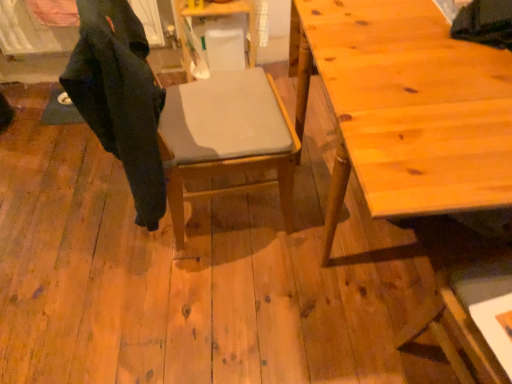
The width and height of the screenshot is (512, 384). What do you see at coordinates (406, 107) in the screenshot?
I see `wooden table at right, which is the first table in bottom-to-top order` at bounding box center [406, 107].

What is the approximate width of matte gray cushion at center?

It is 19.67 inches.

Image resolution: width=512 pixels, height=384 pixels. I want to click on wooden table at center, which ranks as the 2th table in right-to-left order, so click(x=220, y=15).

Describe the element at coordinates (220, 15) in the screenshot. Image resolution: width=512 pixels, height=384 pixels. I see `wooden table at center, placed as the 1th table when sorted from top to bottom` at that location.

This screenshot has width=512, height=384. What are the coordinates of `dark matte fabric robe at left` in the screenshot? It's located at (120, 98).

The image size is (512, 384). I want to click on wooden table at right, acting as the 2th table starting from the left, so click(x=406, y=107).

Does wooden table at center, which ranks as the 2th table in right-to-left order, have a larger size compared to dark matte fabric robe at left?

No.

From the picture: From the image's perspective, is wooden table at center, which is the second table in bottom-to-top order, on top of dark matte fabric robe at left?

Indeed, from the image's perspective, wooden table at center, which is the second table in bottom-to-top order, is shown above dark matte fabric robe at left.

Does wooden table at center, placed as the 1th table when sorted from top to bottom, have a greater width compared to dark matte fabric robe at left?

Indeed, wooden table at center, placed as the 1th table when sorted from top to bottom, has a greater width compared to dark matte fabric robe at left.

From a real-world perspective, starting from the dark matte fabric robe at left, which table is the 2nd one below it? Please provide its 2D coordinates.

[(220, 15)]

From the dark matte fabric robe at left, count 1st table to the right and point to it. Please provide its 2D coordinates.

[(220, 15)]

Is dark matte fabric robe at left closer to camera compared to wooden table at center, which is the second table in bottom-to-top order?

That is True.

In the scene shown: Between dark matte fabric robe at left and wooden table at center, the 1th table in the left-to-right sequence, which one has smaller width?

dark matte fabric robe at left is thinner.

Does dark matte fabric robe at left appear on the left side of wooden table at center, which is the second table in bottom-to-top order?

Yes, dark matte fabric robe at left is to the left of wooden table at center, which is the second table in bottom-to-top order.

From a real-world perspective, is wooden table at center, acting as the 2th table starting from the front, physically below matte gray cushion at center?

Yes.

How different are the orientations of wooden table at center, placed as the 1th table when sorted from top to bottom, and matte gray cushion at center in degrees?

The angle between the facing direction of wooden table at center, placed as the 1th table when sorted from top to bottom, and the facing direction of matte gray cushion at center is 96.1 degrees.

Is point (233, 13) closer to camera compared to point (135, 93)?

No, it is not.

Is wooden table at center, the 1th table in the left-to-right sequence, positioned with its back to matte gray cushion at center?

No, wooden table at center, the 1th table in the left-to-right sequence,'s orientation is not away from matte gray cushion at center.

Could you tell me if dark matte fabric robe at left is facing wooden table at right, the 2th table positioned from the top?

Yes, dark matte fabric robe at left faces towards wooden table at right, the 2th table positioned from the top.

From a real-world perspective, does dark matte fabric robe at left sit lower than wooden table at right, which is the first table in bottom-to-top order?

No.

Looking at this image, does dark matte fabric robe at left contain wooden table at right, which is counted as the 1th table, starting from the front?

No, wooden table at right, which is counted as the 1th table, starting from the front, is not surrounded by dark matte fabric robe at left.

Which is behind, dark matte fabric robe at left or wooden table at right, which is the first table in bottom-to-top order?

dark matte fabric robe at left is more distant.

Measure the distance from matte gray cushion at center to wooden table at right, acting as the 2th table starting from the left.

15.74 inches.

From the image's perspective, which one is positioned lower, matte gray cushion at center or wooden table at right, acting as the 2th table starting from the left?

wooden table at right, acting as the 2th table starting from the left, is shown below in the image.

Is matte gray cushion at center to the right of wooden table at right, the first table positioned from the right, from the viewer's perspective?

No, matte gray cushion at center is not to the right of wooden table at right, the first table positioned from the right.

Which is more distant, (246,128) or (325,69)?

Positioned behind is point (246,128).

Does wooden table at right, which is the first table in bottom-to-top order, have a smaller size compared to dark matte fabric robe at left?

No.

Is wooden table at right, acting as the 2th table starting from the left, oriented towards dark matte fabric robe at left?

Yes.

Can you confirm if wooden table at right, which is the first table in bottom-to-top order, is positioned to the left of dark matte fabric robe at left?

No.

I want to click on robe positioned vertically above the wooden table at right, which is counted as the 1th table, starting from the front (from a real-world perspective), so click(x=120, y=98).

Does dark matte fabric robe at left come in front of matte gray cushion at center?

Yes, dark matte fabric robe at left is closer to the viewer.

Based on the photo, considering the positions of objects dark matte fabric robe at left and matte gray cushion at center in the image provided, who is more to the right, dark matte fabric robe at left or matte gray cushion at center?

matte gray cushion at center is more to the right.

Does point (114, 63) lie in front of point (247, 74)?

Yes.

Between dark matte fabric robe at left and matte gray cushion at center, which one has less height?

With less height is dark matte fabric robe at left.

In the image, there is a wooden table at center, which is the second table in bottom-to-top order. Identify the location of robe below it (from the image's perspective). (120, 98).

Identify the location of robe lying in front of the wooden table at center, marked as the first table in a back-to-front arrangement. The width and height of the screenshot is (512, 384). (120, 98).

Which object lies further to the anchor point wooden table at center, marked as the first table in a back-to-front arrangement, matte gray cushion at center or wooden table at right, which is counted as the 1th table, starting from the front?

wooden table at right, which is counted as the 1th table, starting from the front, is positioned further to the anchor wooden table at center, marked as the first table in a back-to-front arrangement.

Looking at the image, which one is located further to matte gray cushion at center, wooden table at right, the 2th table positioned from the top, or wooden table at center, the 1th table in the left-to-right sequence?

wooden table at center, the 1th table in the left-to-right sequence.

Consider the image. Estimate the real-world distances between objects in this image. Which object is closer to wooden table at right, which is counted as the 2th table, starting from the back, matte gray cushion at center or wooden table at center, which ranks as the 2th table in right-to-left order?

Based on the image, matte gray cushion at center appears to be nearer to wooden table at right, which is counted as the 2th table, starting from the back.

From the image, which object appears to be nearer to matte gray cushion at center, wooden table at center, which ranks as the 2th table in right-to-left order, or wooden table at right, the 2th table positioned from the top?

Based on the image, wooden table at right, the 2th table positioned from the top, appears to be nearer to matte gray cushion at center.

When comparing their distances from dark matte fabric robe at left, does matte gray cushion at center or wooden table at center, marked as the first table in a back-to-front arrangement, seem further?

wooden table at center, marked as the first table in a back-to-front arrangement.

In the scene shown: Which object lies nearer to the anchor point wooden table at right, the 2th table positioned from the top, wooden table at center, the 1th table in the left-to-right sequence, or dark matte fabric robe at left?

Based on the image, dark matte fabric robe at left appears to be nearer to wooden table at right, the 2th table positioned from the top.

Considering their positions, is dark matte fabric robe at left positioned further to wooden table at center, which is the second table in bottom-to-top order, than matte gray cushion at center?

dark matte fabric robe at left is positioned further to the anchor wooden table at center, which is the second table in bottom-to-top order.

Which object lies further to the anchor point matte gray cushion at center, dark matte fabric robe at left or wooden table at right, which is counted as the 2th table, starting from the back?

wooden table at right, which is counted as the 2th table, starting from the back, is positioned further to the anchor matte gray cushion at center.

Identify the location of chair between dark matte fabric robe at left and wooden table at right, the first table positioned from the right, in the horizontal direction. This screenshot has width=512, height=384. (175, 118).

Identify the location of robe between wooden table at right, acting as the 2th table starting from the left, and wooden table at center, marked as the first table in a back-to-front arrangement, along the z-axis. (120, 98).

This screenshot has height=384, width=512. Identify the location of chair between wooden table at right, which is counted as the 1th table, starting from the front, and wooden table at center, which ranks as the 2th table in right-to-left order, in the front-back direction. (175, 118).

Where is `chair positioned between dark matte fabric robe at left and wooden table at center, the 1th table in the left-to-right sequence, from near to far`? This screenshot has width=512, height=384. chair positioned between dark matte fabric robe at left and wooden table at center, the 1th table in the left-to-right sequence, from near to far is located at coordinates (175, 118).